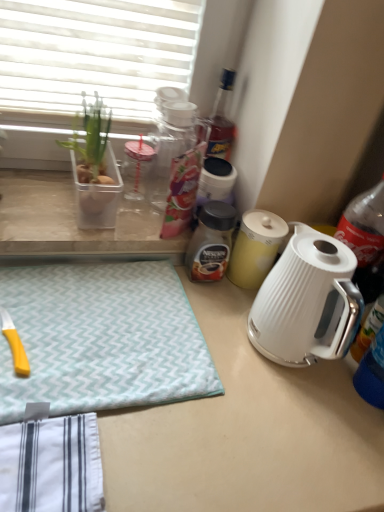
Locate an element on the screen. vacant area on top of white glossy electric kettle at center (from a real-world perspective) is located at coordinates (281, 378).